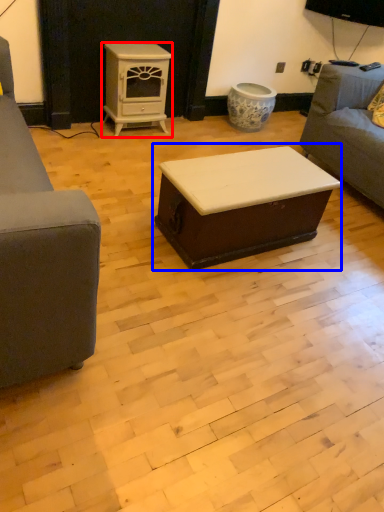
Question: Which point is further to the camera, appliance (highlighted by a red box) or table (highlighted by a blue box)?

Choices:
 (A) appliance
 (B) table

Answer: (A)